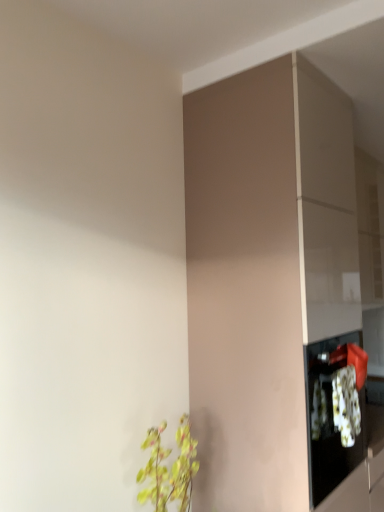
Question: In terms of width, does matte brown cabinet at center look wider or thinner when compared to green leafy plant at lower left?

Choices:
 (A) wide
 (B) thin

Answer: (A)

Question: From the image's perspective, is matte brown cabinet at center above or below green leafy plant at lower left?

Choices:
 (A) below
 (B) above

Answer: (B)

Question: Is point (274, 436) closer or farther from the camera than point (160, 424)?

Choices:
 (A) closer
 (B) farther

Answer: (A)

Question: From the image's perspective, is green leafy plant at lower left above or below matte brown cabinet at center?

Choices:
 (A) below
 (B) above

Answer: (A)

Question: Considering the positions of point (163, 501) and point (226, 327), is point (163, 501) closer or farther from the camera than point (226, 327)?

Choices:
 (A) closer
 (B) farther

Answer: (A)

Question: Choose the correct answer: Is green leafy plant at lower left inside matte brown cabinet at center or outside it?

Choices:
 (A) inside
 (B) outside

Answer: (B)

Question: Is green leafy plant at lower left bigger or smaller than matte brown cabinet at center?

Choices:
 (A) big
 (B) small

Answer: (B)